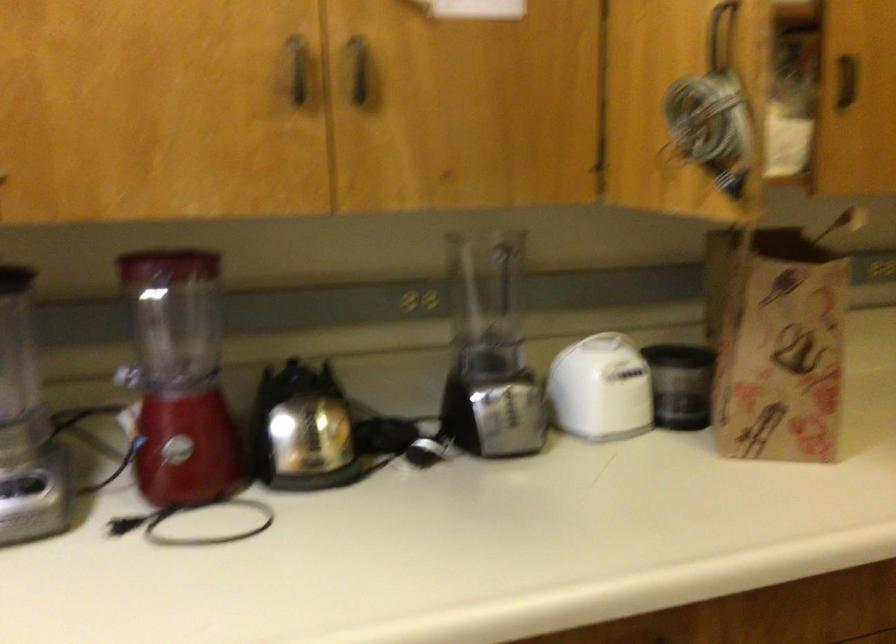
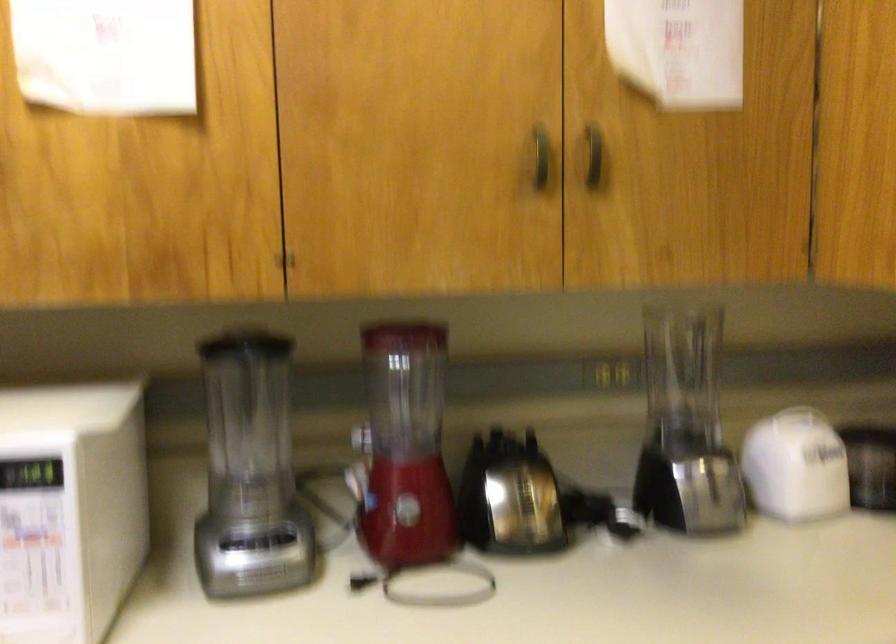
Question: How did the camera likely rotate?

Choices:
 (A) Left
 (B) Right
 (C) Up
 (D) Down

Answer: (A)